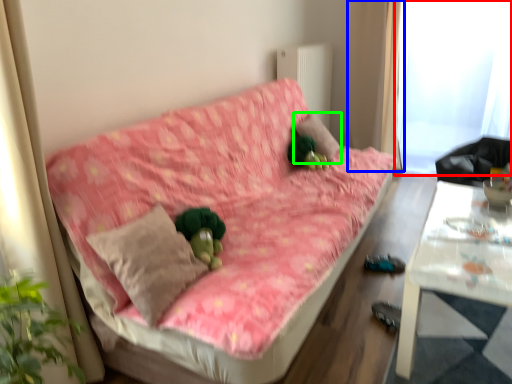
Question: Which object is the closest to the window screen (highlighted by a red box)? Choose among these: curtain (highlighted by a blue box) or pillow (highlighted by a green box).

Choices:
 (A) curtain
 (B) pillow

Answer: (A)